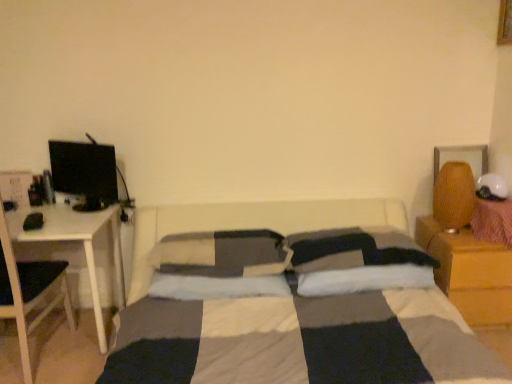
Question: Is the surface of wooden nightstand at right in direct contact with white soft pillow at center, the first pillow when ordered from right to left?

Choices:
 (A) no
 (B) yes

Answer: (A)

Question: Is wooden nightstand at right at the right side of white soft pillow at center, the 3th pillow in the left-to-right sequence?

Choices:
 (A) yes
 (B) no

Answer: (A)

Question: From the image's perspective, is wooden nightstand at right over white soft pillow at center, the first pillow when ordered from right to left?

Choices:
 (A) no
 (B) yes

Answer: (A)

Question: Considering the relative positions of wooden nightstand at right and white soft pillow at center, the first pillow when ordered from right to left, in the image provided, is wooden nightstand at right to the left of white soft pillow at center, the first pillow when ordered from right to left, from the viewer's perspective?

Choices:
 (A) yes
 (B) no

Answer: (B)

Question: Is wooden nightstand at right aimed at white soft pillow at center, the first pillow when ordered from right to left?

Choices:
 (A) yes
 (B) no

Answer: (B)

Question: From a real-world perspective, is wooden nightstand at right physically above white soft pillow at center, the first pillow when ordered from right to left?

Choices:
 (A) yes
 (B) no

Answer: (B)

Question: Can you confirm if white soft pillow at center, the 3th pillow when ordered from right to left, is positioned to the right of white soft pillow at center, the first pillow when ordered from right to left?

Choices:
 (A) yes
 (B) no

Answer: (B)

Question: Considering the relative positions of white soft pillow at center, the 3th pillow when ordered from right to left, and white soft pillow at center, the first pillow when ordered from right to left, in the image provided, is white soft pillow at center, the 3th pillow when ordered from right to left, in front of white soft pillow at center, the first pillow when ordered from right to left,?

Choices:
 (A) yes
 (B) no

Answer: (B)

Question: Does white soft pillow at center, the 3th pillow when ordered from right to left, have a larger size compared to white soft pillow at center, the first pillow when ordered from right to left?

Choices:
 (A) yes
 (B) no

Answer: (A)

Question: Is white soft pillow at center, which is the 1th pillow in left-to-right order, surrounding white soft pillow at center, the first pillow when ordered from right to left?

Choices:
 (A) no
 (B) yes

Answer: (A)

Question: Is white soft pillow at center, which is the 1th pillow in left-to-right order, far away from white soft pillow at center, the 3th pillow in the left-to-right sequence?

Choices:
 (A) yes
 (B) no

Answer: (B)

Question: Does white soft pillow at center, which is the 1th pillow in left-to-right order, lie behind white soft pillow at center, the first pillow when ordered from right to left?

Choices:
 (A) yes
 (B) no

Answer: (A)

Question: Is white glossy table at left at the right side of soft gray pillow at center, which ranks as the second pillow in left-to-right order?

Choices:
 (A) no
 (B) yes

Answer: (A)